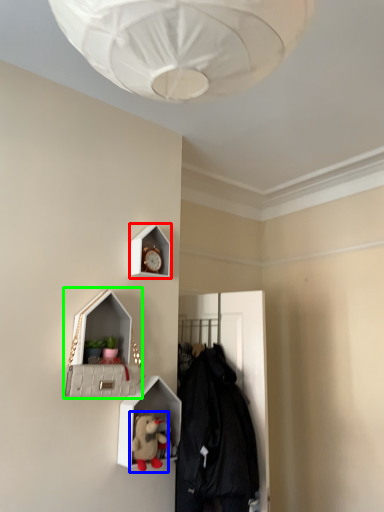
Question: Which object is positioned farthest from clock (highlighted by a red box)? Select from toy (highlighted by a blue box) and medicine cabinet (highlighted by a green box).

Choices:
 (A) toy
 (B) medicine cabinet

Answer: (A)